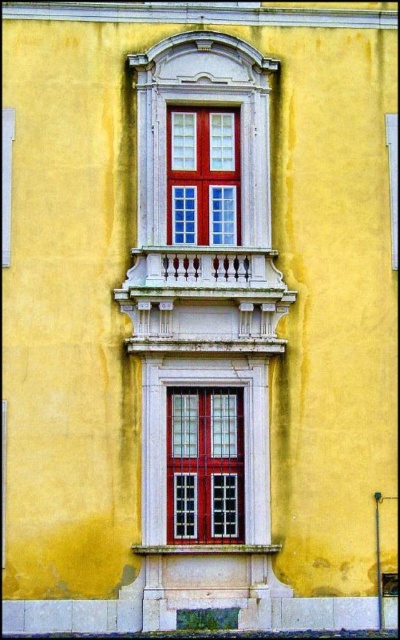
You are standing in front of the building and want to enter the building through the matte red glass window at center. To do so, you need to pass under the white stone balcony at upper center. Is the balcony above the window?

Yes, the white stone balcony at upper center is above the matte red glass window at center, so you will need to pass under it to reach the window.

You are an architect examining the building facade. You notice the matte red glass window at center and the matte white window frame at center. Which of these two elements occupies a larger area on the facade?

The matte white window frame at center is larger than the matte red glass window at center, so the matte white window frame at center occupies a larger area on the facade.

You are an architect inspecting the building facade. You notice two windows at the center. Which one is taller between the matte red glass window at center and the matte glass window at center?

The matte red glass window at center is much taller than the matte glass window at center according to the description.